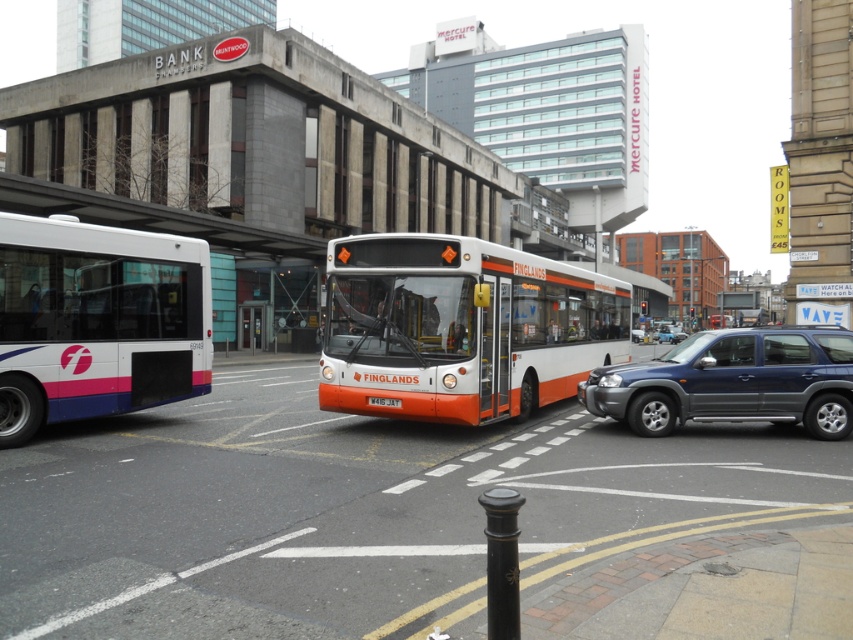
You are a delivery driver who needs to park your truck between the metallic blue suv at center and the black polished metal pole at center. Can your truck fit in the space between them?

The metallic blue suv at center is larger than the black polished metal pole at center, so the space between them may be sufficient for your truck to fit. However, without knowing the exact dimensions of your truck, it is difficult to determine for sure.

You are a delivery person who needs to load a package onto a truck. The package is too tall to fit through standard doorways. You have to choose between the orange matte bus at center and the white matte bus at left. Which bus should you choose to ensure the package can fit inside?

The white matte bus at left has a greater height than the orange matte bus at center, so you should choose the white matte bus at left to ensure the package can fit inside.